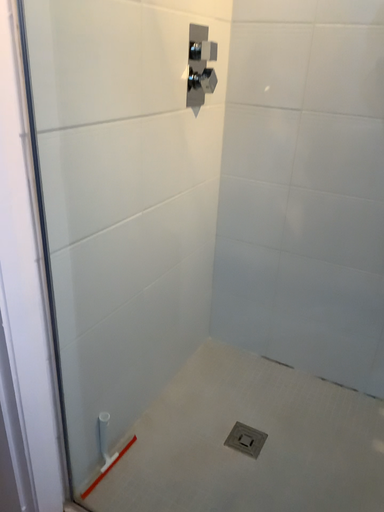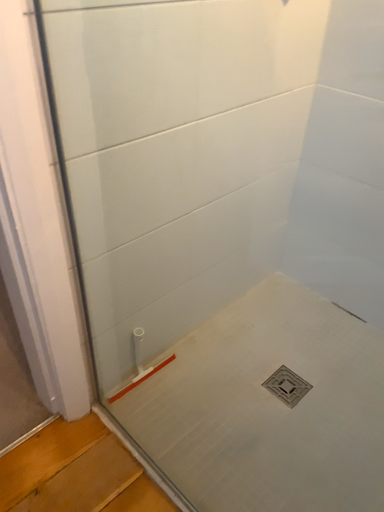
Question: Which way did the camera rotate in the video?

Choices:
 (A) rotated upward
 (B) rotated downward

Answer: (B)